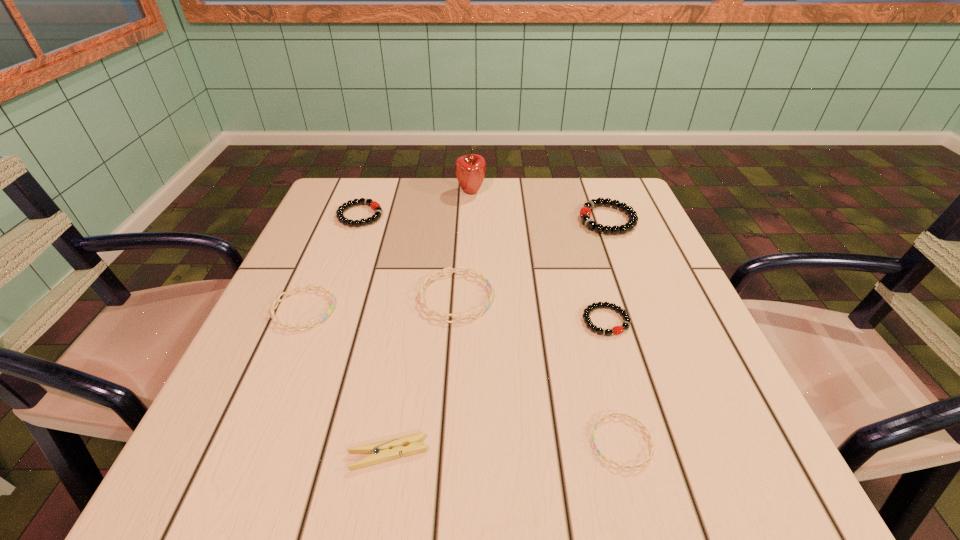
I want to click on vacant area between the leftmost blue bracelet and the clothespin, so click(346, 381).

The height and width of the screenshot is (540, 960). What are the coordinates of `free spot between the biggest blue bracelet and the nearest black bracelet` in the screenshot? It's located at (531, 309).

Image resolution: width=960 pixels, height=540 pixels. Find the location of `empty location between the fourth bracelet from right to left and the shortest object`. empty location between the fourth bracelet from right to left and the shortest object is located at coordinates (539, 369).

Find the location of `object that ranks as the third closest to the second biggest blue bracelet`. object that ranks as the third closest to the second biggest blue bracelet is located at coordinates (390, 449).

Point out which object is positioned as the seventh nearest to the second blue bracelet from left to right. Please provide its 2D coordinates. Your answer should be formatted as a tuple, i.e. [(x, y)], where the tuple contains the x and y coordinates of a point satisfying the conditions above.

[(470, 169)]

Choose which bracelet is the fifth nearest neighbor to the biggest black bracelet. Please provide its 2D coordinates. Your answer should be formatted as a tuple, i.e. [(x, y)], where the tuple contains the x and y coordinates of a point satisfying the conditions above.

[(278, 300)]

Identify which bracelet is located as the fifth nearest to the third bracelet from left to right. Please provide its 2D coordinates. Your answer should be formatted as a tuple, i.e. [(x, y)], where the tuple contains the x and y coordinates of a point satisfying the conditions above.

[(585, 212)]

At what (x,y) coordinates should I click in order to perform the action: click on black bracelet that is the third closest one to the leftmost blue bracelet. Please return your answer as a coordinate pair (x, y). The image size is (960, 540). Looking at the image, I should click on (585, 212).

This screenshot has height=540, width=960. Find the location of `black bracelet identified as the closest to the biggest black bracelet`. black bracelet identified as the closest to the biggest black bracelet is located at coordinates (616, 330).

Image resolution: width=960 pixels, height=540 pixels. Find the location of `blue bracelet that is the second closest to the rightmost blue bracelet`. blue bracelet that is the second closest to the rightmost blue bracelet is located at coordinates (278, 300).